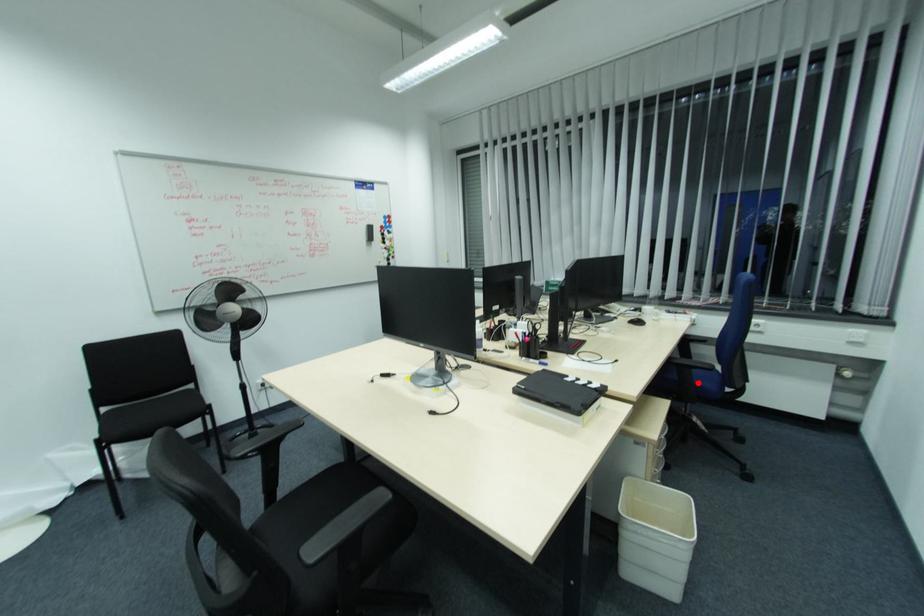
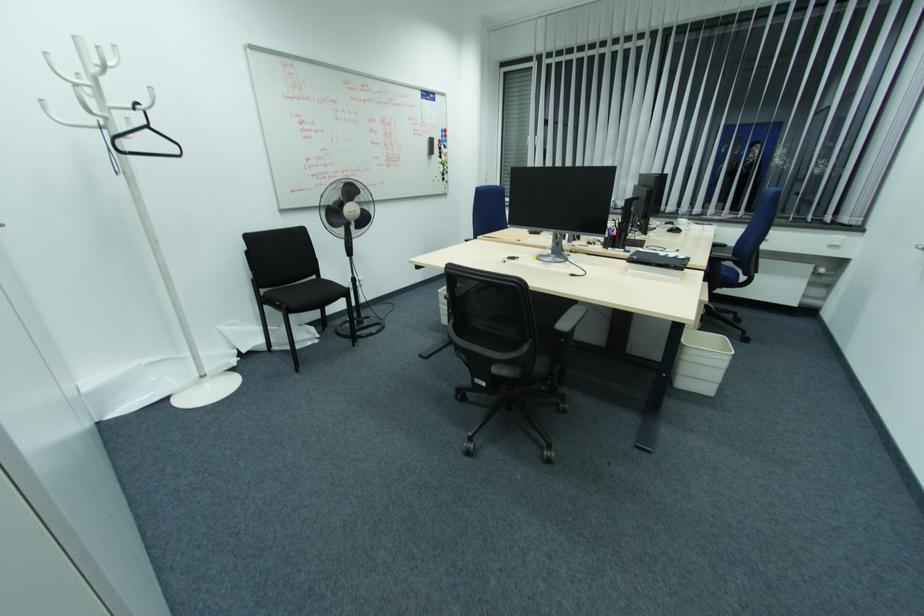
Question: I am providing you with two images of the same scene from different viewpoints. Given a red point in image1, look at the same physical point in image2. Is it:

Choices:
 (A) Closer to the viewpoint
 (B) Farther from the viewpoint

Answer: (B)